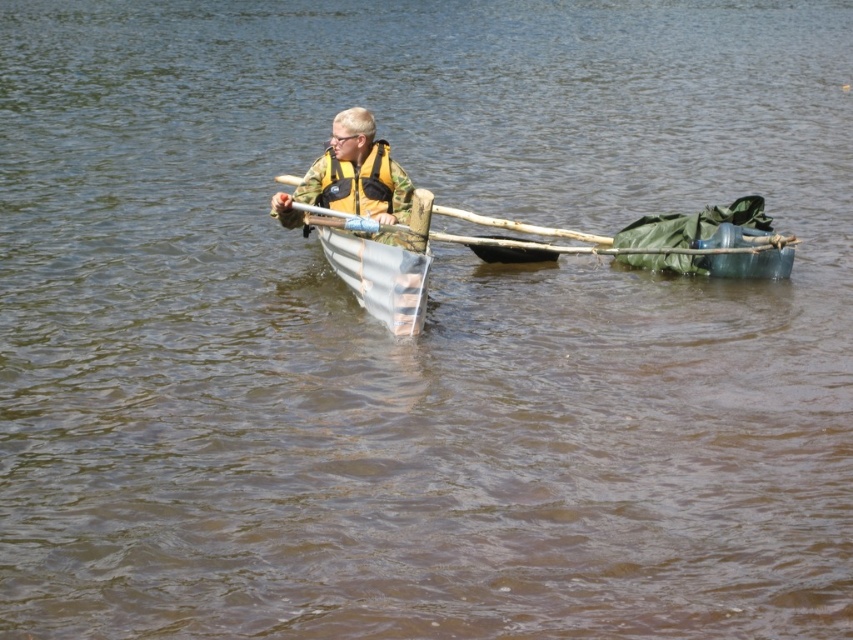
The height and width of the screenshot is (640, 853). What do you see at coordinates (351, 177) in the screenshot? I see `camouflage fabric jacket at center` at bounding box center [351, 177].

Describe the element at coordinates (351, 177) in the screenshot. Image resolution: width=853 pixels, height=640 pixels. I see `camouflage fabric jacket at center` at that location.

Locate an element on the screen. camouflage fabric jacket at center is located at coordinates (351, 177).